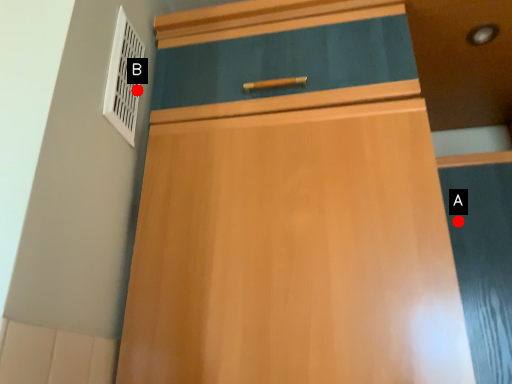
Question: Two points are circled on the image, labeled by A and B beside each circle. Which of the following is the farthest from the observer?

Choices:
 (A) A is further
 (B) B is further

Answer: (A)